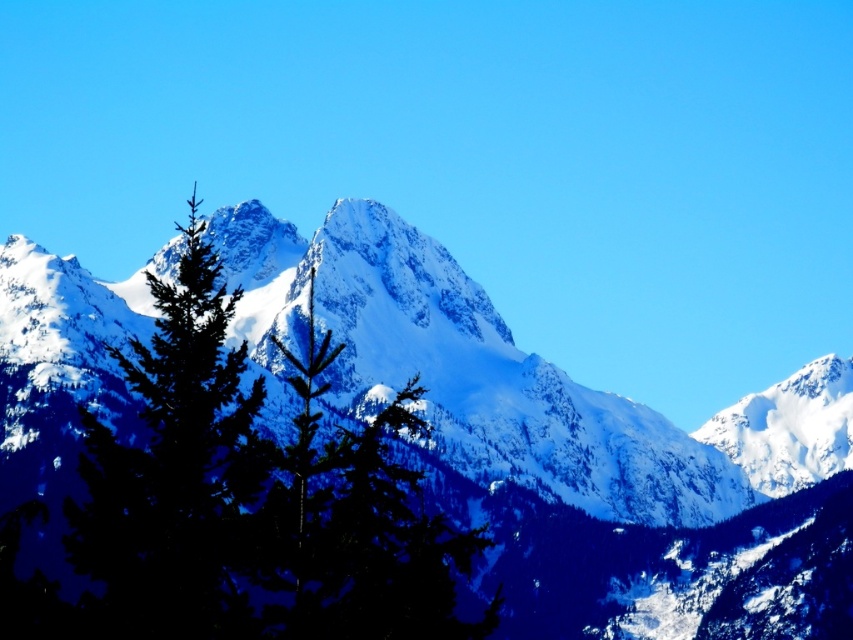
You are planning a hiking trip and want to know if the green matte tree at center is taller than the snowy peak at center. Based on the scene description, what can you conclude?

The snowy peak at center has a greater height compared to the green matte tree at center, so the snowy peak is taller than the green matte tree.

You are an outdoor photographer planning to capture the snowy peak at center and the green matte tree at center in a single frame. Based on their positions, which object should you focus on first to ensure both are in sharp focus?

The snowy peak at center is further to the viewer than the green matte tree at center, so you should focus on the snowy peak at center first to ensure both are in sharp focus.